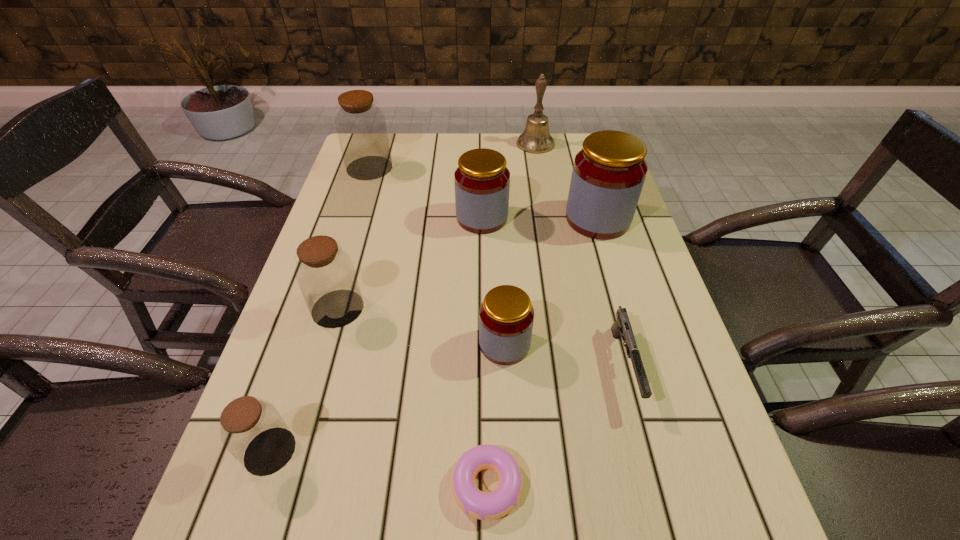
This screenshot has height=540, width=960. Find the location of `vacant space located at the muzzle end of the second shortest object`. vacant space located at the muzzle end of the second shortest object is located at coordinates (648, 453).

Identify the location of vacant space situated on the left of the shortest object. This screenshot has height=540, width=960. (384, 485).

Identify the location of bell at the far edge. (536, 138).

Image resolution: width=960 pixels, height=540 pixels. I want to click on jar that is positioned at the far edge, so click(x=361, y=128).

The width and height of the screenshot is (960, 540). What are the coordinates of `jar that is at the right edge` in the screenshot? It's located at (608, 175).

Find the location of a particular element. Image resolution: width=960 pixels, height=540 pixels. gun that is positioned at the right edge is located at coordinates (622, 327).

Identify the location of object present at the far left corner. The width and height of the screenshot is (960, 540). (361, 128).

Locate an element on the screen. free spot at the far edge of the desktop is located at coordinates (516, 154).

The height and width of the screenshot is (540, 960). Find the location of `vacant area at the left edge of the desktop`. vacant area at the left edge of the desktop is located at coordinates (372, 186).

At what (x,y) coordinates should I click in order to perform the action: click on free spot at the right edge of the desktop. Please return your answer as a coordinate pair (x, y). The height and width of the screenshot is (540, 960). Looking at the image, I should click on (708, 483).